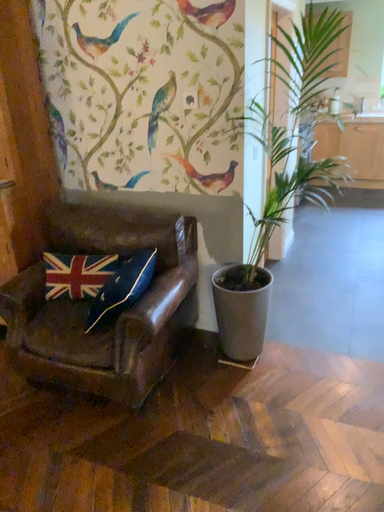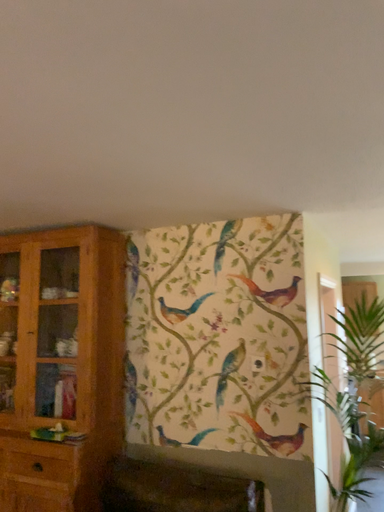
Question: Which way did the camera rotate in the video?

Choices:
 (A) rotated downward
 (B) rotated upward

Answer: (B)